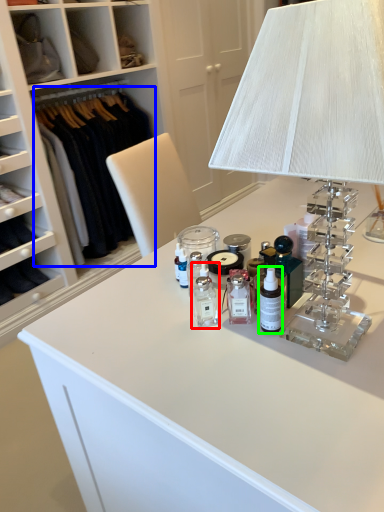
Question: Estimate the real-world distances between objects in this image. Which object is closer to toiletry (highlighted by a red box), clothing (highlighted by a blue box) or toiletry (highlighted by a green box)?

Choices:
 (A) clothing
 (B) toiletry

Answer: (B)